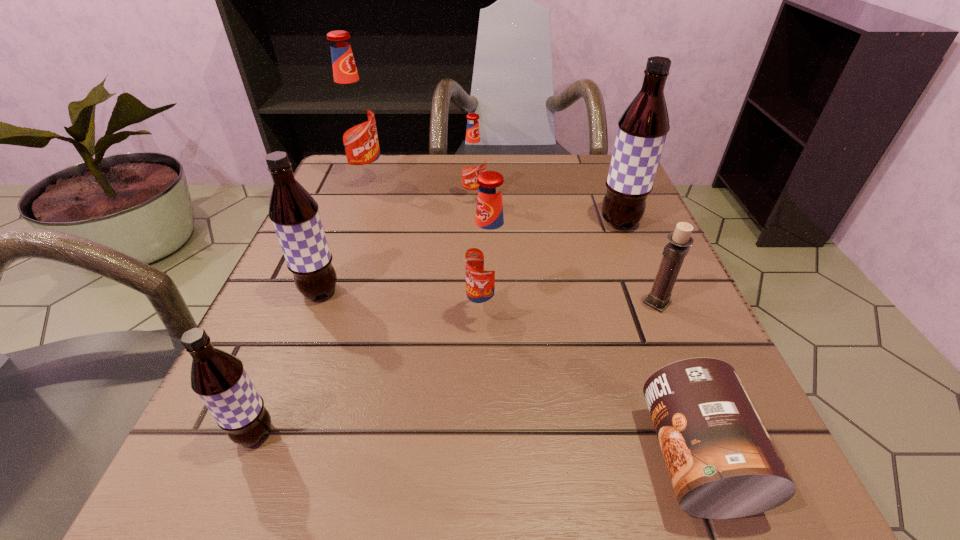
Locate an element on the screen. The height and width of the screenshot is (540, 960). unoccupied position between the second farthest red root beer and the second smallest brown root beer is located at coordinates (396, 245).

The height and width of the screenshot is (540, 960). I want to click on vacant region between the seventh tallest object and the fifth nearest root beer, so 565,251.

Find the location of `free spot between the second farthest root beer and the nearest root beer`. free spot between the second farthest root beer and the nearest root beer is located at coordinates click(364, 316).

Image resolution: width=960 pixels, height=540 pixels. I want to click on blank region between the farthest object and the seventh tallest object, so click(512, 241).

Locate an element on the screen. The image size is (960, 540). free spot between the nearest brown root beer and the second farthest brown root beer is located at coordinates (287, 363).

Select which object is the third closest to the rightmost root beer. Please provide its 2D coordinates. Your answer should be formatted as a tuple, i.e. [(x, y)], where the tuple contains the x and y coordinates of a point satisfying the conditions above.

[(489, 256)]

Select which object appears as the sixth closest to the second biggest brown root beer. Please provide its 2D coordinates. Your answer should be formatted as a tuple, i.e. [(x, y)], where the tuple contains the x and y coordinates of a point satisfying the conditions above.

[(642, 129)]

Select which root beer is the closest to the nearest root beer. Please provide its 2D coordinates. Your answer should be formatted as a tuple, i.e. [(x, y)], where the tuple contains the x and y coordinates of a point satisfying the conditions above.

[(294, 213)]

Locate which root beer ranks in proximity to the nearest brown root beer. Please provide its 2D coordinates. Your answer should be formatted as a tuple, i.e. [(x, y)], where the tuple contains the x and y coordinates of a point satisfying the conditions above.

[(294, 213)]

Where is `red root beer identified as the third closest to the biggest brown root beer`? The image size is (960, 540). red root beer identified as the third closest to the biggest brown root beer is located at coordinates (353, 116).